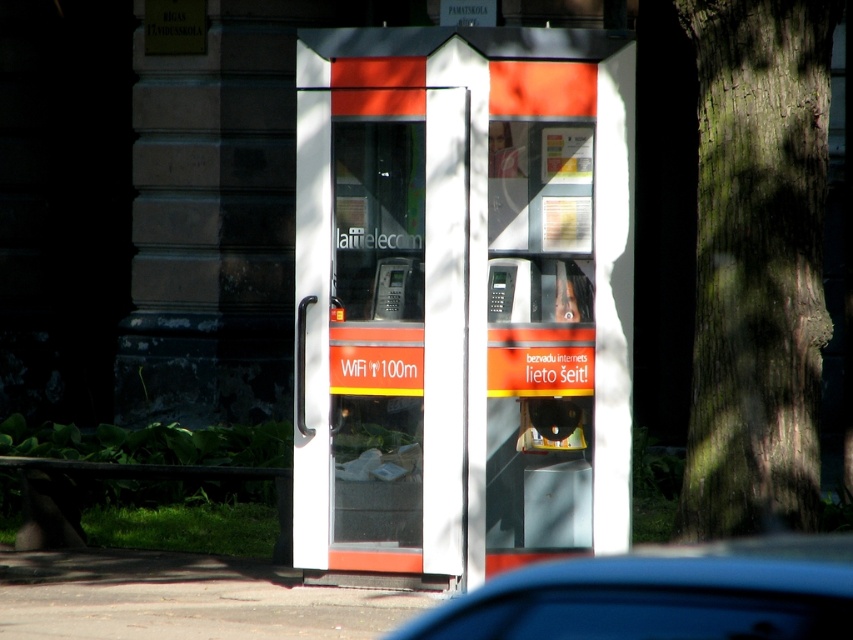
Image resolution: width=853 pixels, height=640 pixels. What do you see at coordinates (662, 595) in the screenshot? I see `blue glossy car at lower center` at bounding box center [662, 595].

Is point (627, 588) positioned before point (398, 259)?

Yes.

Find the location of a particular element. The height and width of the screenshot is (640, 853). blue glossy car at lower center is located at coordinates (662, 595).

What are the coordinates of `blue glossy car at lower center` in the screenshot? It's located at (662, 595).

Between point (790, 380) and point (523, 600), which one is positioned behind?

Point (790, 380)

Does green rough bark tree at right appear on the right side of blue glossy car at lower center?

Yes, green rough bark tree at right is to the right of blue glossy car at lower center.

Which is in front, point (820, 147) or point (811, 534)?

Point (811, 534)

This screenshot has width=853, height=640. What are the coordinates of `green rough bark tree at right` in the screenshot? It's located at (757, 264).

Is orange glossy phone booth at center further to camera compared to blue glossy car at lower center?

That is True.

Which is in front, point (357, 385) or point (842, 634)?

Point (842, 634) is in front.

Who is more forward, (299,125) or (732,550)?

Point (732,550) is in front.

Find the location of a particular element. Image resolution: width=853 pixels, height=640 pixels. orange glossy phone booth at center is located at coordinates (462, 300).